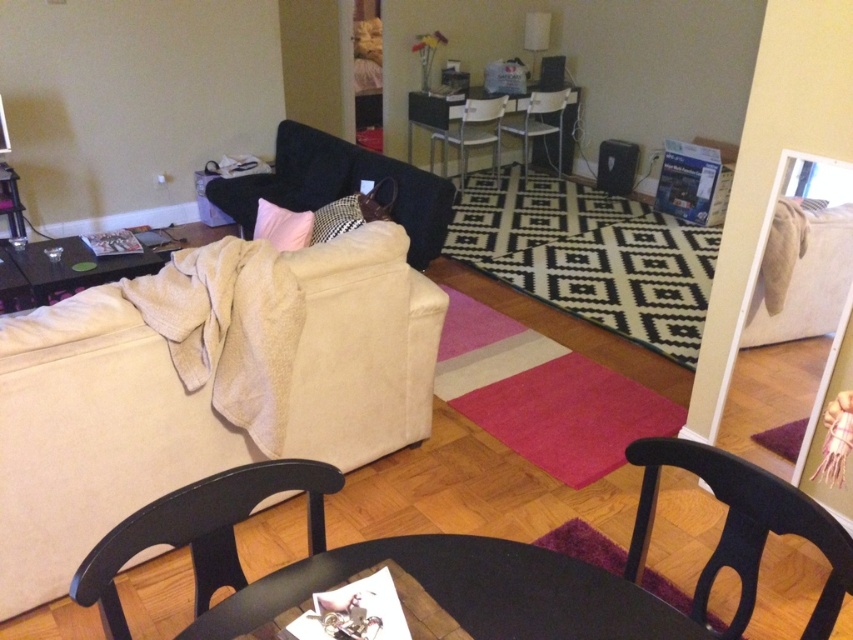
Based on the photo, you are standing in the living room and want to place a small potted plant exactly at the point marked as point [323,480]. Considering the room layout described, can you confirm if this location is within reach of the beige sofa?

The distance of point [323,480] from viewer is 4.42 feet, so placing the plant at this point would be 4.42 feet away from the sofa, which is within a reasonable reach.

You are standing in the living room and want to move to the black wood armchair at lower center. What are the coordinates of the armchair to help you navigate?

Result: The coordinates of the black wood armchair at lower center are at point (201, 531).